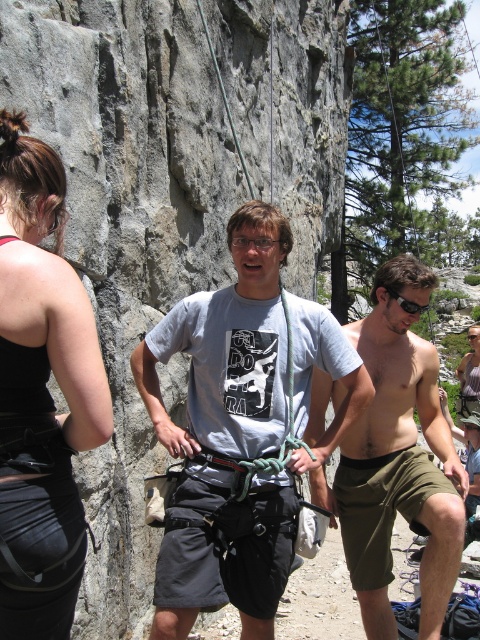
Question: Can you confirm if black fabric harness at left is wider than shiny metallic shorts at center?

Choices:
 (A) no
 (B) yes

Answer: (A)

Question: Can you confirm if gray rock cliff at center is smaller than shiny metallic shorts at center?

Choices:
 (A) yes
 (B) no

Answer: (B)

Question: Is black fabric harness at left positioned at the back of shiny metallic shorts at center?

Choices:
 (A) yes
 (B) no

Answer: (B)

Question: Which of these objects is positioned closest to the black fabric harness at left?

Choices:
 (A) gray fabric shirt at center
 (B) gray rock cliff at center
 (C) shiny metallic shorts at center

Answer: (A)

Question: Which is farther from the gray fabric shirt at center?

Choices:
 (A) shiny metallic shorts at center
 (B) gray rock cliff at center
 (C) black fabric harness at left

Answer: (B)

Question: Which point is closer to the camera?

Choices:
 (A) (122, 547)
 (B) (424, 477)

Answer: (B)